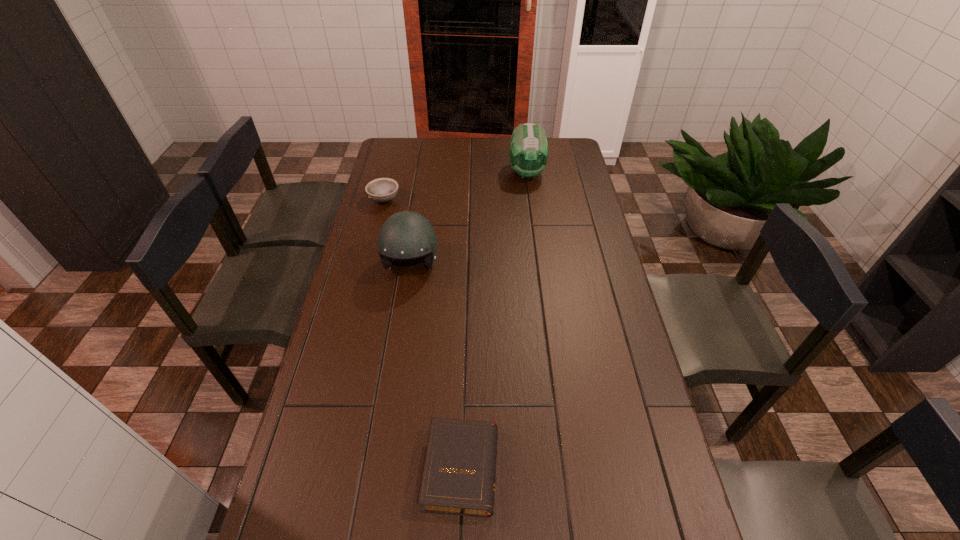
This screenshot has height=540, width=960. I want to click on vacant space located 0.300m on the right of the third tallest object, so click(x=471, y=200).

Where is `free space located 0.300m on the back of the nearest object`? The width and height of the screenshot is (960, 540). free space located 0.300m on the back of the nearest object is located at coordinates (466, 332).

Where is `object that is at the far edge`? The image size is (960, 540). object that is at the far edge is located at coordinates (528, 154).

Find the location of a particular element. football helmet that is positioned at the left edge is located at coordinates click(x=405, y=235).

Locate an element on the screen. bowl positioned at the left edge is located at coordinates (381, 190).

I want to click on free location at the far edge of the desktop, so click(442, 150).

Locate an element on the screen. Image resolution: width=960 pixels, height=540 pixels. vacant area at the left edge of the desktop is located at coordinates (365, 361).

In the image, there is a desktop. Where is `vacant space at the right edge`? The image size is (960, 540). vacant space at the right edge is located at coordinates tap(666, 532).

Identify the location of free space between the second shortest object and the shortest object. (422, 334).

Locate an element on the screen. vacant space in between the bowl and the Bible is located at coordinates (422, 334).